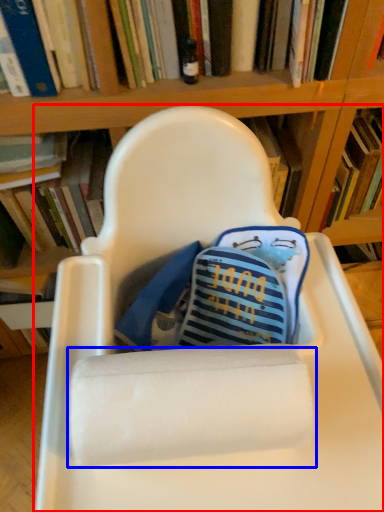
Question: Which object is further to the camera taking this photo, chair (highlighted by a red box) or paper towel (highlighted by a blue box)?

Choices:
 (A) chair
 (B) paper towel

Answer: (B)